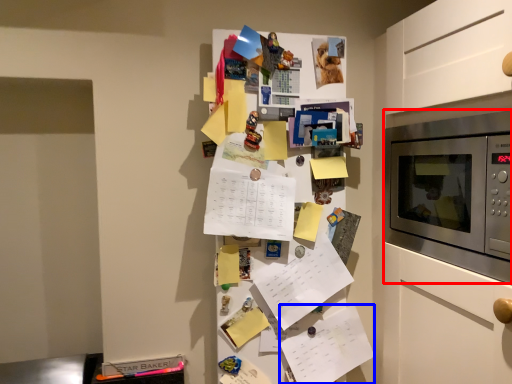
Question: Which object is further to the camera taking this photo, microwave oven (highlighted by a red box) or list (highlighted by a blue box)?

Choices:
 (A) microwave oven
 (B) list

Answer: (B)